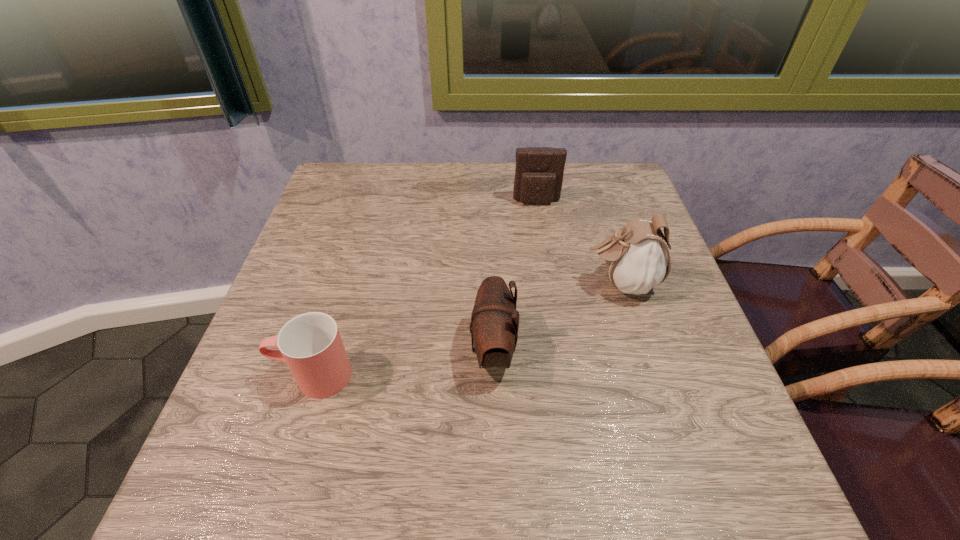
I want to click on empty location between the second nearest pouch and the cup, so click(468, 329).

I want to click on vacant point located between the leftmost pouch and the second pouch from left to right, so tap(515, 276).

Where is `blank region between the third nearest object and the cup`? blank region between the third nearest object and the cup is located at coordinates (468, 329).

Locate an element on the screen. Image resolution: width=960 pixels, height=540 pixels. object that stands as the third closest to the nearest pouch is located at coordinates (539, 171).

Identify which object is the closest to the shortest object. Please provide its 2D coordinates. Your answer should be formatted as a tuple, i.e. [(x, y)], where the tuple contains the x and y coordinates of a point satisfying the conditions above.

[(494, 320)]

Locate an element on the screen. Image resolution: width=960 pixels, height=540 pixels. pouch that is the second closest to the cup is located at coordinates (637, 257).

Locate an element on the screen. The image size is (960, 540). pouch that stands as the third closest to the cup is located at coordinates (539, 171).

The width and height of the screenshot is (960, 540). I want to click on vacant position in the image that satisfies the following two spatial constraints: 1. with an open flap on the second pouch from left to right; 2. with the flap open on the third object from right to left, so click(x=560, y=350).

Find the location of a particular element. The height and width of the screenshot is (540, 960). free space in the image that satisfies the following two spatial constraints: 1. with an open flap on the farthest object; 2. with the flap open on the nearest pouch is located at coordinates click(x=560, y=350).

Where is `free spot that satisfies the following two spatial constraints: 1. with an open flap on the second object from right to left; 2. with the flap open on the third object from right to left`? This screenshot has height=540, width=960. free spot that satisfies the following two spatial constraints: 1. with an open flap on the second object from right to left; 2. with the flap open on the third object from right to left is located at coordinates (560, 350).